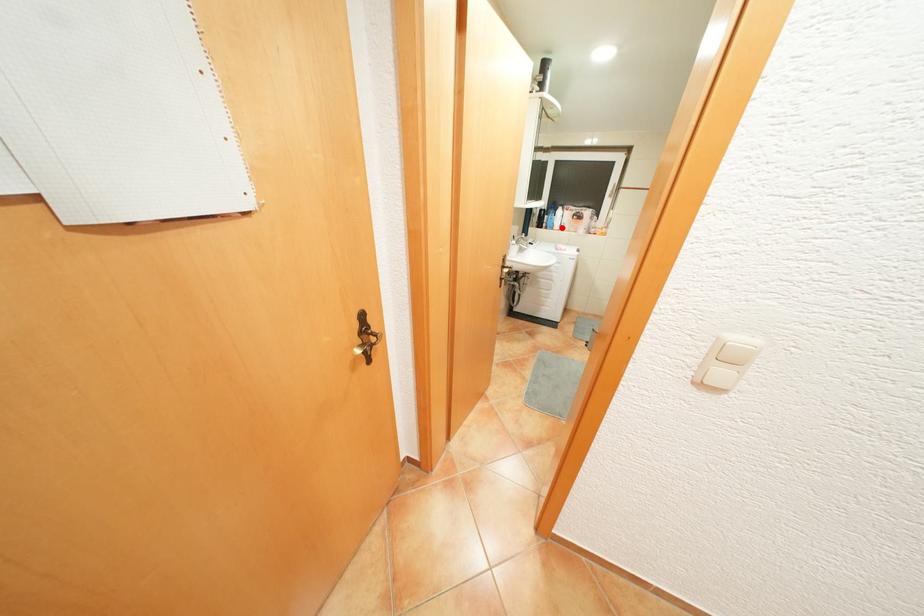
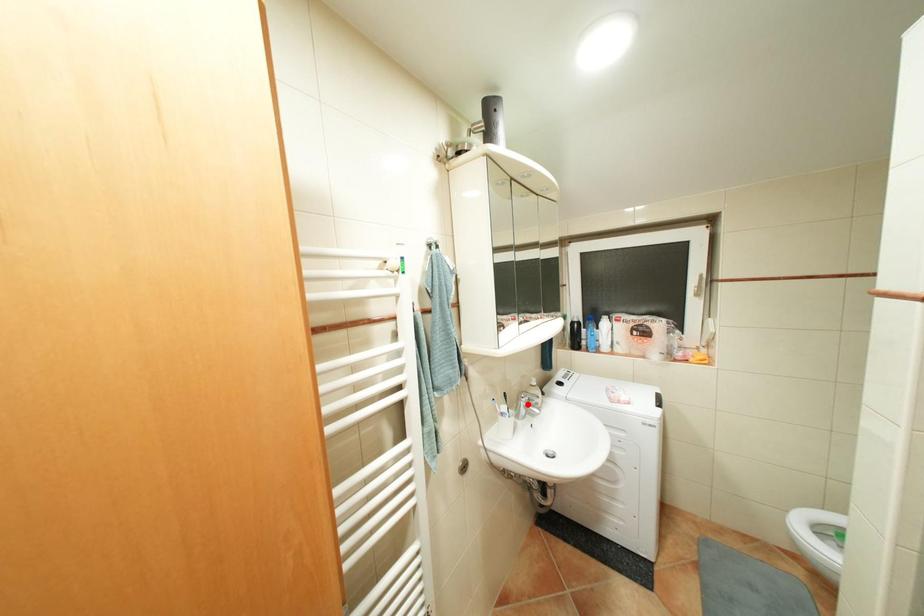
I am providing you with two images of the same scene from different viewpoints. A red point is marked on the first image and another point is marked on the second image. Is the marked point in image1 the same physical position as the marked point in image2?

No